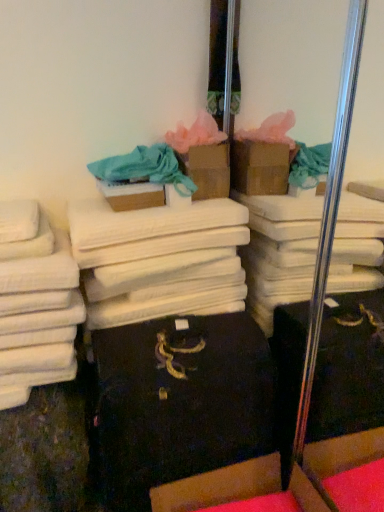
Question: Is white cotton towels at center bigger than brown cardboard box at center, the second cardboard box positioned from the bottom?

Choices:
 (A) yes
 (B) no

Answer: (A)

Question: Are white cotton towels at center and brown cardboard box at center, which appears as the 2th cardboard box when viewed from the back, located far from each other?

Choices:
 (A) no
 (B) yes

Answer: (A)

Question: Is the surface of white cotton towels at center in direct contact with brown cardboard box at center, which ranks as the second cardboard box in top-to-bottom order?

Choices:
 (A) no
 (B) yes

Answer: (A)

Question: Does white cotton towels at center have a smaller size compared to brown cardboard box at center, which appears as the 2th cardboard box when viewed from the back?

Choices:
 (A) yes
 (B) no

Answer: (B)

Question: Can you confirm if white cotton towels at center is shorter than brown cardboard box at center, arranged as the 2th cardboard box when viewed from the front?

Choices:
 (A) no
 (B) yes

Answer: (A)

Question: Is white cotton towels at center positioned in front of brown cardboard box at center, which ranks as the second cardboard box in top-to-bottom order?

Choices:
 (A) no
 (B) yes

Answer: (B)

Question: Is white cotton towels at left smaller than white cotton towels at center?

Choices:
 (A) yes
 (B) no

Answer: (A)

Question: Can you confirm if white cotton towels at left is wider than white cotton towels at center?

Choices:
 (A) yes
 (B) no

Answer: (B)

Question: Is white cotton towels at left positioned far away from white cotton towels at center?

Choices:
 (A) no
 (B) yes

Answer: (A)

Question: From the image's perspective, would you say white cotton towels at left is shown under white cotton towels at center?

Choices:
 (A) no
 (B) yes

Answer: (B)

Question: From the image's perspective, is white cotton towels at left located above white cotton towels at center?

Choices:
 (A) yes
 (B) no

Answer: (B)

Question: From a real-world perspective, is white cotton towels at left positioned under white cotton towels at center based on gravity?

Choices:
 (A) no
 (B) yes

Answer: (B)

Question: Considering the relative sizes of cardboard box at lower center, which ranks as the 3th cardboard box in top-to-bottom order, and white cotton towels at left in the image provided, is cardboard box at lower center, which ranks as the 3th cardboard box in top-to-bottom order, thinner than white cotton towels at left?

Choices:
 (A) yes
 (B) no

Answer: (B)